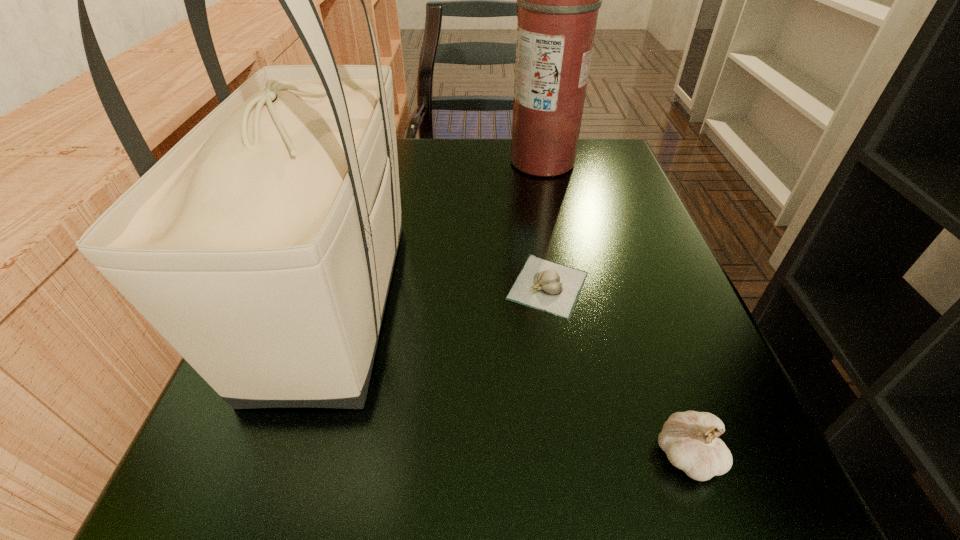
Locate an element on the screen. vacant space that satisfies the following two spatial constraints: 1. on the front-facing side of the taller garlic; 2. on the right side of the farthest object is located at coordinates (604, 456).

Identify the location of free space that satisfies the following two spatial constraints: 1. on the front-facing side of the fire extinguisher; 2. on the left side of the taller garlic. The image size is (960, 540). (604, 456).